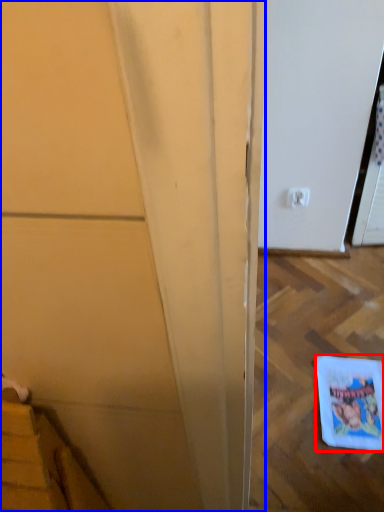
Question: Among these objects, which one is nearest to the camera, comic book (highlighted by a red box) or door (highlighted by a blue box)?

Choices:
 (A) comic book
 (B) door

Answer: (B)